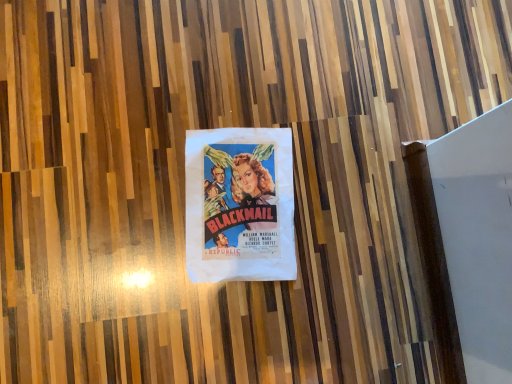
Identify the location of blank space situated above white paper poster at center (from a real-world perspective). (240, 205).